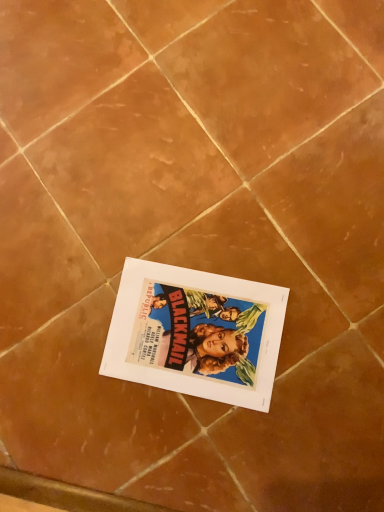
Where is `vacant space in front of matte paper poster at center`? The image size is (384, 512). vacant space in front of matte paper poster at center is located at coordinates (271, 431).